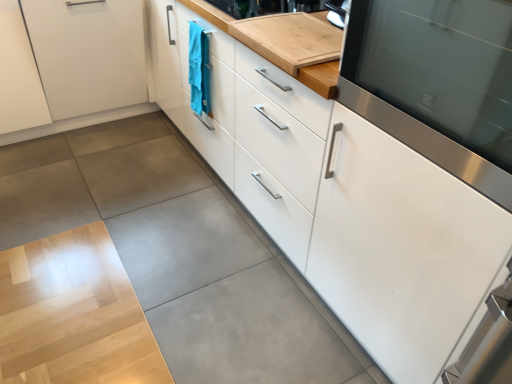
Question: Is teal fabric towel at center taller than stainless steel oven at right?

Choices:
 (A) yes
 (B) no

Answer: (A)

Question: Is teal fabric towel at center positioned in front of stainless steel oven at right?

Choices:
 (A) no
 (B) yes

Answer: (A)

Question: From a real-world perspective, is teal fabric towel at center physically below stainless steel oven at right?

Choices:
 (A) no
 (B) yes

Answer: (B)

Question: Is teal fabric towel at center positioned with its back to stainless steel oven at right?

Choices:
 (A) yes
 (B) no

Answer: (B)

Question: Is teal fabric towel at center positioned far away from stainless steel oven at right?

Choices:
 (A) no
 (B) yes

Answer: (B)

Question: Considering their positions, is white glossy cabinet at center, the second cabinetry positioned from the right, located in front of or behind teal fabric towel at center?

Choices:
 (A) front
 (B) behind

Answer: (A)

Question: Considering the positions of point pos(309,236) and point pos(195,57), is point pos(309,236) closer or farther from the camera than point pos(195,57)?

Choices:
 (A) farther
 (B) closer

Answer: (B)

Question: Visually, is white glossy cabinet at center, acting as the 2th cabinetry starting from the left, positioned to the left or to the right of teal fabric towel at center?

Choices:
 (A) right
 (B) left

Answer: (B)

Question: Is white glossy cabinet at center, acting as the 2th cabinetry starting from the left, wider or thinner than teal fabric towel at center?

Choices:
 (A) wide
 (B) thin

Answer: (A)

Question: Considering the positions of teal fabric towel at center and white matte cabinet at lower left, positioned as the 3th cabinetry in right-to-left order, in the image, is teal fabric towel at center taller or shorter than white matte cabinet at lower left, positioned as the 3th cabinetry in right-to-left order,?

Choices:
 (A) short
 (B) tall

Answer: (A)

Question: Based on their positions, is teal fabric towel at center located to the left or right of white matte cabinet at lower left, which appears as the 1th cabinetry when viewed from the left?

Choices:
 (A) left
 (B) right

Answer: (B)

Question: Does point (189, 52) appear closer or farther from the camera than point (106, 11)?

Choices:
 (A) closer
 (B) farther

Answer: (A)

Question: Would you say teal fabric towel at center is inside or outside white matte cabinet at lower left, positioned as the 3th cabinetry in right-to-left order?

Choices:
 (A) outside
 (B) inside

Answer: (A)

Question: From a real-world perspective, is white glossy cabinet at center, acting as the 2th cabinetry starting from the left, positioned above or below stainless steel oven at right?

Choices:
 (A) below
 (B) above

Answer: (A)

Question: From the image's perspective, relative to stainless steel oven at right, is white glossy cabinet at center, acting as the 2th cabinetry starting from the left, above or below?

Choices:
 (A) below
 (B) above

Answer: (B)